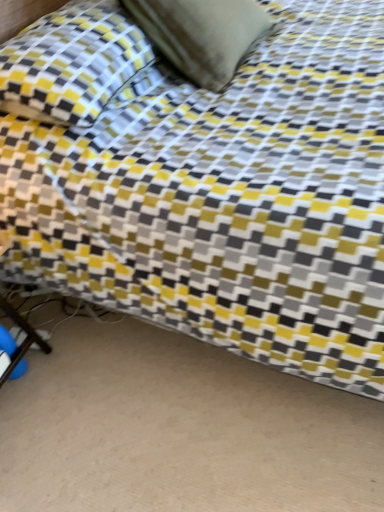
Question: Is suede-like beige pillow at upper center, the first pillow viewed from the right, wider or thinner than yellow fabric pillow at upper left, the second pillow in the right-to-left sequence?

Choices:
 (A) thin
 (B) wide

Answer: (A)

Question: Is suede-like beige pillow at upper center, marked as the second pillow in a left-to-right arrangement, in front of or behind yellow fabric pillow at upper left, the 1th pillow when ordered from left to right, in the image?

Choices:
 (A) front
 (B) behind

Answer: (B)

Question: From their relative heights in the image, would you say suede-like beige pillow at upper center, the first pillow viewed from the right, is taller or shorter than yellow fabric pillow at upper left, the second pillow in the right-to-left sequence?

Choices:
 (A) short
 (B) tall

Answer: (B)

Question: Would you say yellow fabric pillow at upper left, the 1th pillow when ordered from left to right, is to the left or to the right of suede-like beige pillow at upper center, the first pillow viewed from the right, in the picture?

Choices:
 (A) left
 (B) right

Answer: (A)

Question: Is yellow fabric pillow at upper left, the 1th pillow when ordered from left to right, bigger or smaller than suede-like beige pillow at upper center, marked as the second pillow in a left-to-right arrangement?

Choices:
 (A) big
 (B) small

Answer: (A)

Question: Choose the correct answer: Is yellow fabric pillow at upper left, the second pillow in the right-to-left sequence, inside suede-like beige pillow at upper center, marked as the second pillow in a left-to-right arrangement, or outside it?

Choices:
 (A) outside
 (B) inside

Answer: (A)

Question: From a real-world perspective, is yellow fabric pillow at upper left, the 1th pillow when ordered from left to right, above or below suede-like beige pillow at upper center, the first pillow viewed from the right?

Choices:
 (A) above
 (B) below

Answer: (B)